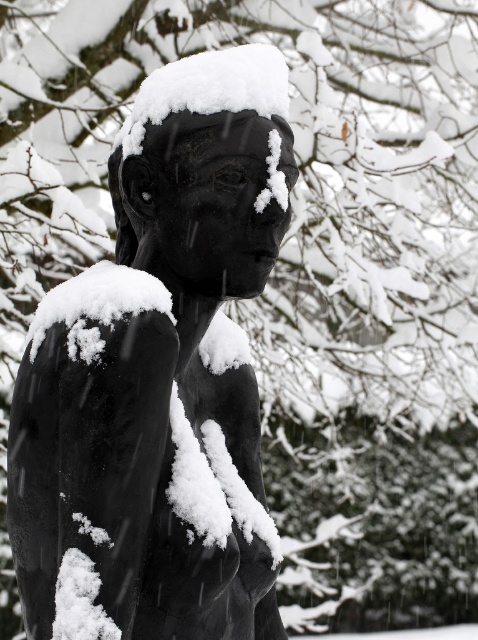
Question: Among these points, which one is farthest from the camera?

Choices:
 (A) (42, 464)
 (B) (213, 52)

Answer: (B)

Question: Is the position of matte black statue at center more distant than that of white fluffy snow at center?

Choices:
 (A) yes
 (B) no

Answer: (B)

Question: Which of the following is the farthest from the observer?

Choices:
 (A) matte black statue at center
 (B) white fluffy snow at center

Answer: (B)

Question: Does matte black statue at center appear on the left side of white fluffy snow at center?

Choices:
 (A) yes
 (B) no

Answer: (B)

Question: Does matte black statue at center have a larger size compared to white fluffy snow at center?

Choices:
 (A) yes
 (B) no

Answer: (A)